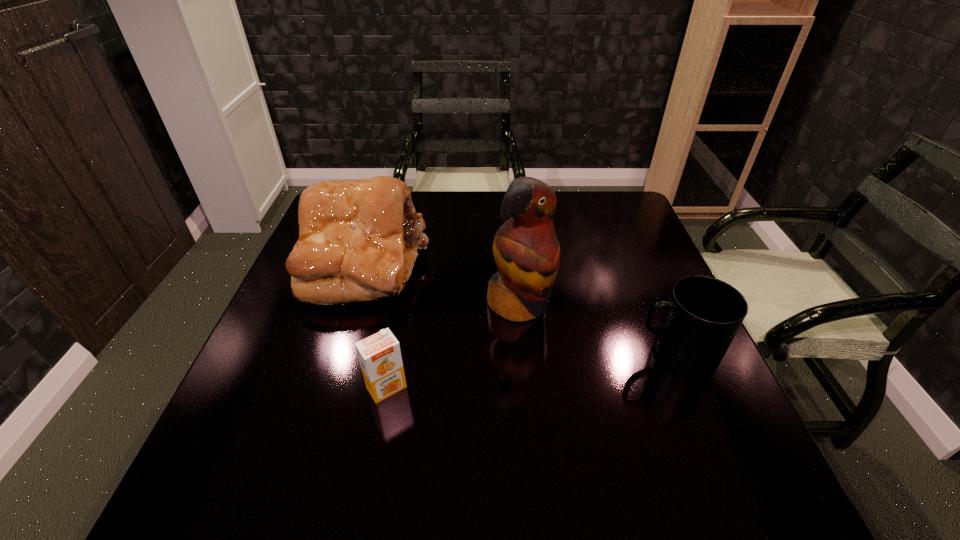
You are a GUI agent. You are given a task and a screenshot of the screen. Output one action in this format:
    pyautogui.click(x=<x>, y=<y>)
    Task: Click on the vacant space on the desktop that is between the orange juice and the rightmost object and is positioned on the filling side of the bread
    This screenshot has height=540, width=960.
    Given the screenshot: What is the action you would take?
    pyautogui.click(x=537, y=369)

Find the location of a particular element. The image size is (960, 540). free space on the desktop that is between the orange juice and the rightmost object and is positioned on the face of the tallest object is located at coordinates (569, 366).